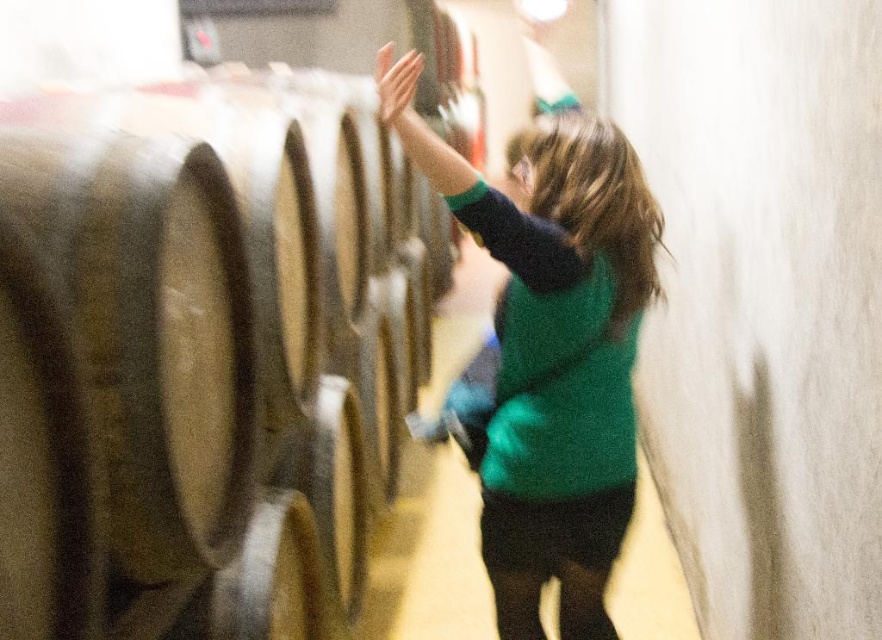
Does point (348, 593) come farther from viewer compared to point (509, 538)?

Yes, point (348, 593) is farther from viewer.

Is point (146, 161) closer to camera compared to point (617, 440)?

Yes, point (146, 161) is closer to viewer.

This screenshot has height=640, width=882. Find the location of `smooth wood barrel at left`. smooth wood barrel at left is located at coordinates (212, 352).